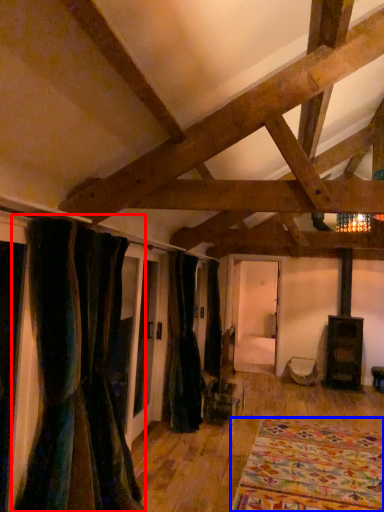
Question: Which object appears closest to the camera in this image, curtain (highlighted by a red box) or blanket (highlighted by a blue box)?

Choices:
 (A) curtain
 (B) blanket

Answer: (A)